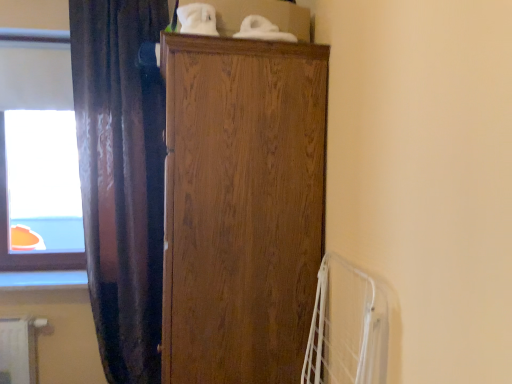
Question: Considering their positions, is dark velvet curtain at left located in front of or behind wooden cabinet at center?

Choices:
 (A) behind
 (B) front

Answer: (A)

Question: From a real-world perspective, relative to wooden cabinet at center, is dark velvet curtain at left vertically above or below?

Choices:
 (A) above
 (B) below

Answer: (A)

Question: Which is farther from the transparent glass window at upper left?

Choices:
 (A) dark velvet curtain at left
 (B) wooden cabinet at center

Answer: (B)

Question: Which is nearer to the dark velvet curtain at left?

Choices:
 (A) wooden cabinet at center
 (B) transparent glass window at upper left

Answer: (B)